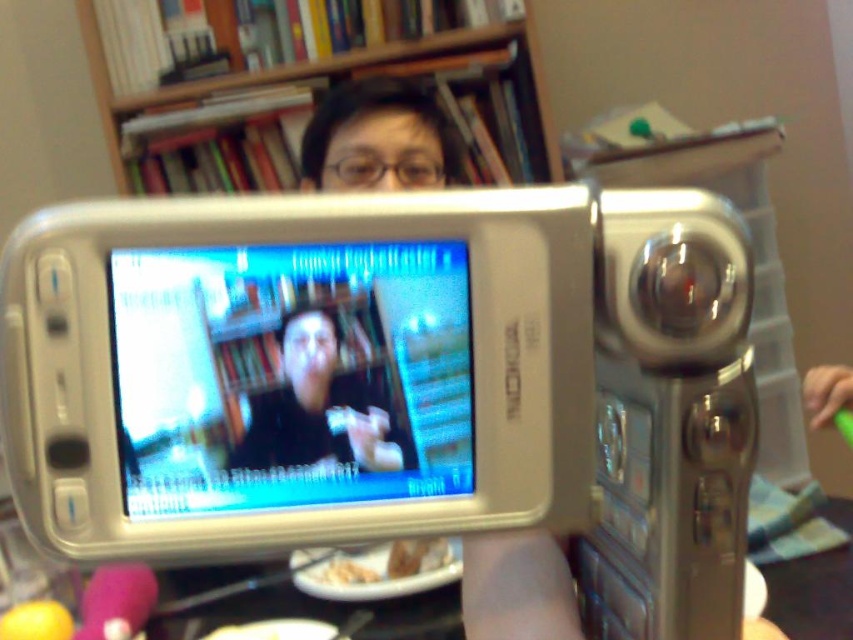
Question: Which object is farther from the camera taking this photo?

Choices:
 (A) silver metallic camera at center
 (B) shiny silver phone at center

Answer: (B)

Question: Is silver metallic camera at center smaller than black matte shirt at center?

Choices:
 (A) no
 (B) yes

Answer: (A)

Question: Can you confirm if silver metallic camera at center is positioned to the right of wooden bookshelf at upper center?

Choices:
 (A) yes
 (B) no

Answer: (A)

Question: Among these points, which one is nearest to the camera?

Choices:
 (A) (84, 545)
 (B) (297, 326)
 (C) (447, 45)

Answer: (A)

Question: Can you confirm if shiny silver phone at center is thinner than black matte shirt at center?

Choices:
 (A) yes
 (B) no

Answer: (B)

Question: Considering the real-world distances, which object is farthest from the wooden bookshelf at upper center?

Choices:
 (A) shiny silver phone at center
 (B) black matte shirt at center
 (C) silver metallic camera at center

Answer: (B)